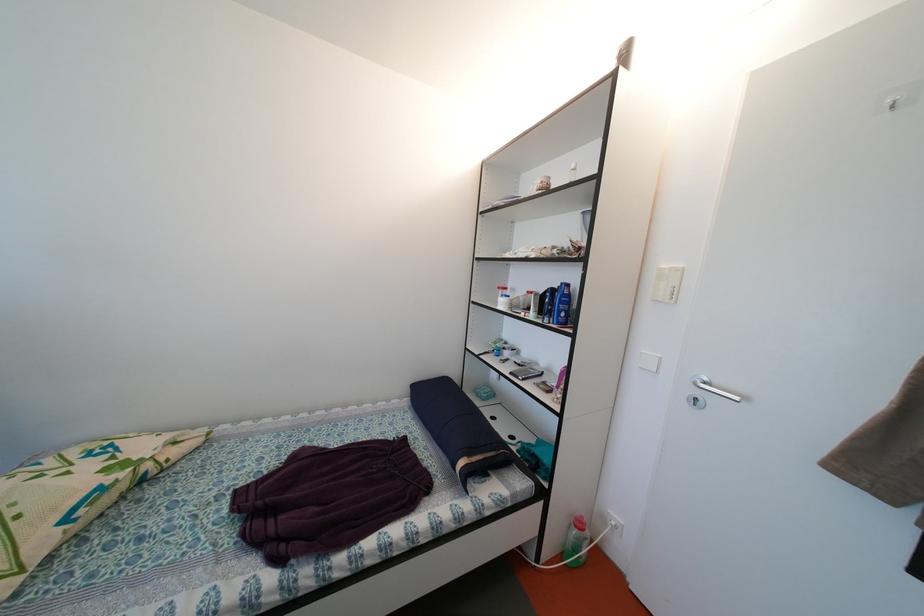
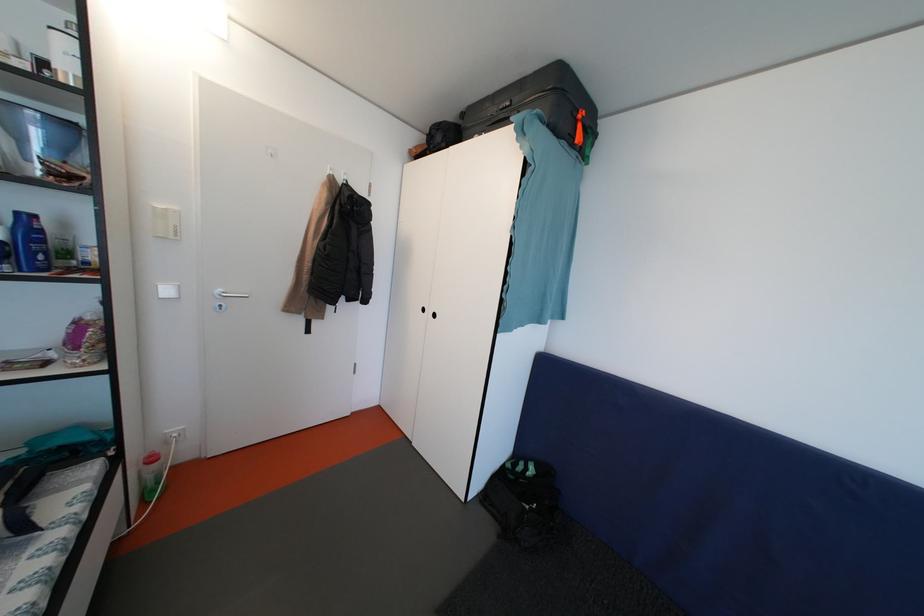
Find the pixel in the second image that matches (x=569, y=320) in the first image.

(49, 262)